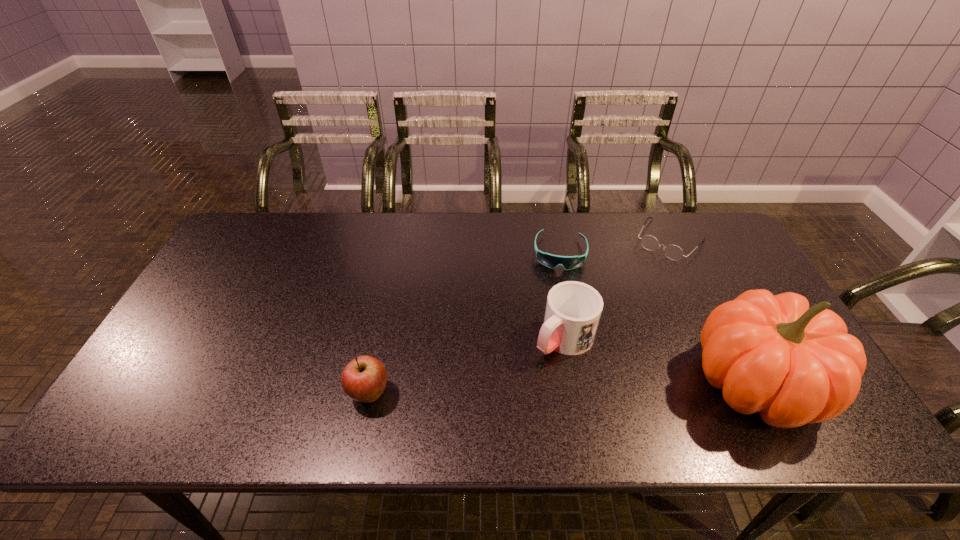
Image resolution: width=960 pixels, height=540 pixels. I want to click on the leftmost object, so click(363, 379).

Identify the location of pumpkin. (772, 354).

Where is `spectacles`? This screenshot has width=960, height=540. spectacles is located at coordinates (673, 252).

Find the location of a particular element. sunglasses is located at coordinates (551, 261).

Where is `mug`? Image resolution: width=960 pixels, height=540 pixels. mug is located at coordinates coord(573,309).

You are a GUI agent. You are given a task and a screenshot of the screen. Output one action in this format:
    pyautogui.click(x=<x>, y=<y>)
    Task: Click on the free region located on the left of the leftmost object
    The width and height of the screenshot is (960, 540).
    Given the screenshot: What is the action you would take?
    pyautogui.click(x=212, y=394)

This screenshot has width=960, height=540. What are the coordinates of `vacant space located on the left of the pumpkin` in the screenshot? It's located at (627, 382).

This screenshot has height=540, width=960. In order to click on free space located through the lenses of the spectacles in this screenshot , I will do `click(613, 319)`.

Locate an element on the screen. The width and height of the screenshot is (960, 540). vacant point located through the lenses of the spectacles is located at coordinates 618,313.

Where is `free space located 0.140m through the lenses of the spectacles`? The height and width of the screenshot is (540, 960). free space located 0.140m through the lenses of the spectacles is located at coordinates (638, 284).